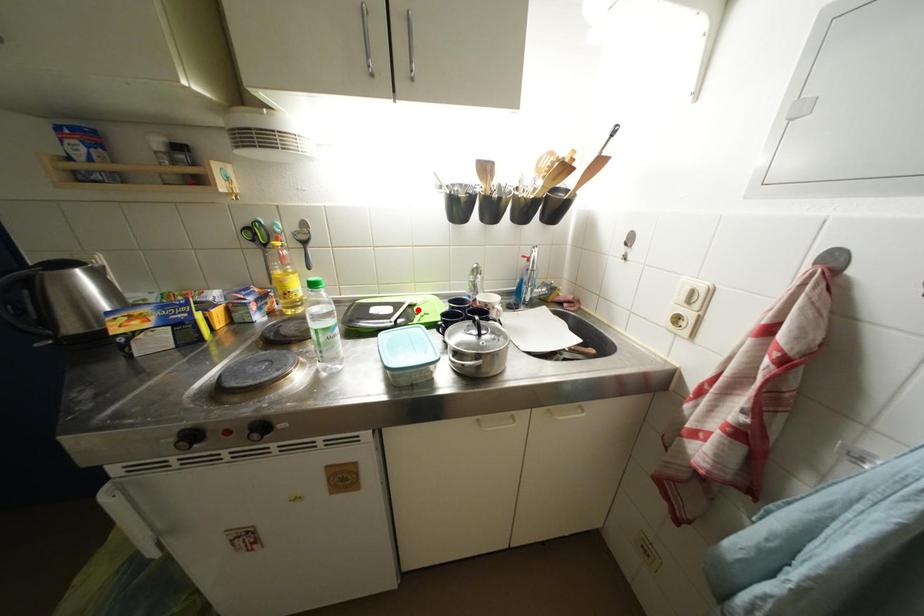
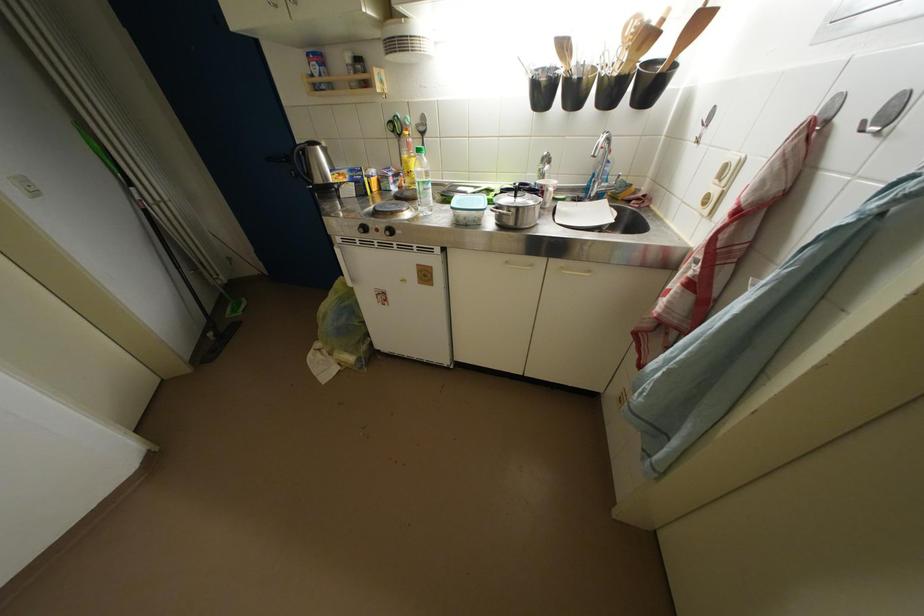
Find the pixel in the second image that matches the highlighted location in the first image.

(495, 193)